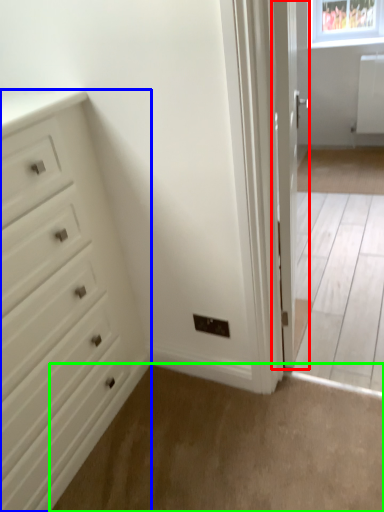
Question: Based on their relative distances, which object is farther from door (highlighted by a red box)? Choose from chest of drawers (highlighted by a blue box) and plain (highlighted by a green box).

Choices:
 (A) chest of drawers
 (B) plain

Answer: (A)